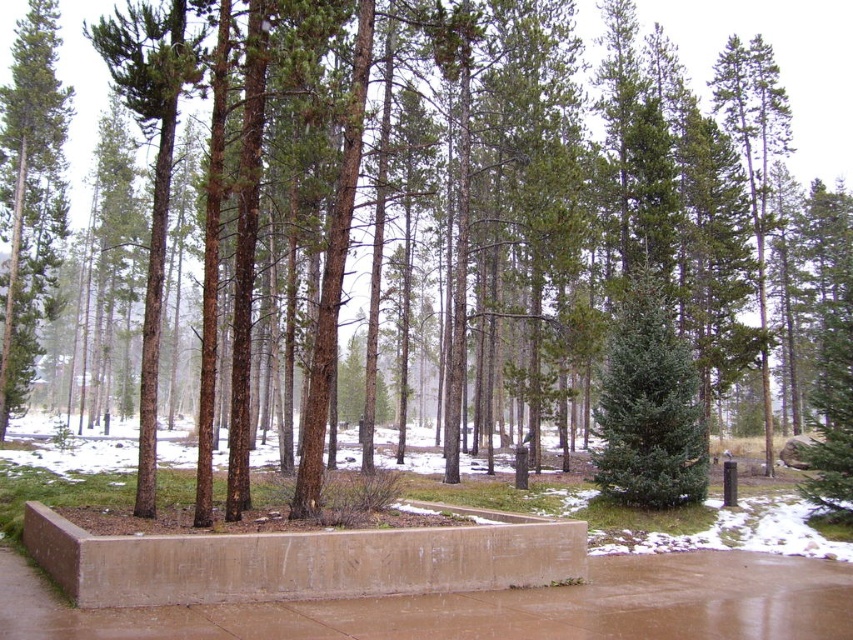
You are a hiker trying to navigate through the forest. You see a green matte tree at left and a green matte evergreen tree at center. Which tree is positioned more to the east if you are facing north?

The green matte tree at left is positioned more to the east because when facing north, left would correspond to the west direction, but the description states it is to the left of the evergreen tree at center. Wait, this seems conflicting. Let me think again. If you are facing north, your left is west and right is east. If the tree at left is to the west of the center tree, then the center tree is east of the left tree. But the question asks which is more to the east when facing north. The evergreen at the

You are a small squirrel that wants to cross the brown concrete pavement at center to reach the green matte evergreen tree at center. Can you easily jump from the pavement to the tree trunk?

The brown concrete pavement at center is shorter than the green matte evergreen tree at center, so the squirrel would need to climb or find a lower branch to reach the tree trunk.